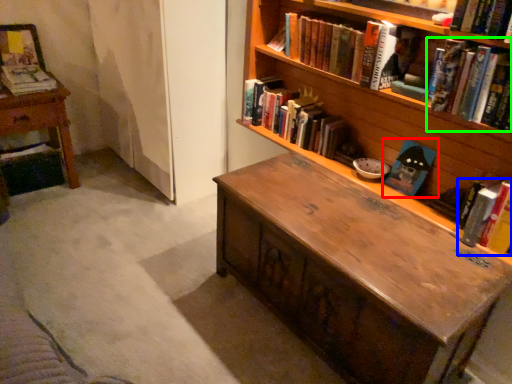
Question: Which object is positioned closest to book (highlighted by a red box)? Select from book (highlighted by a blue box) and book (highlighted by a green box).

Choices:
 (A) book
 (B) book

Answer: (A)